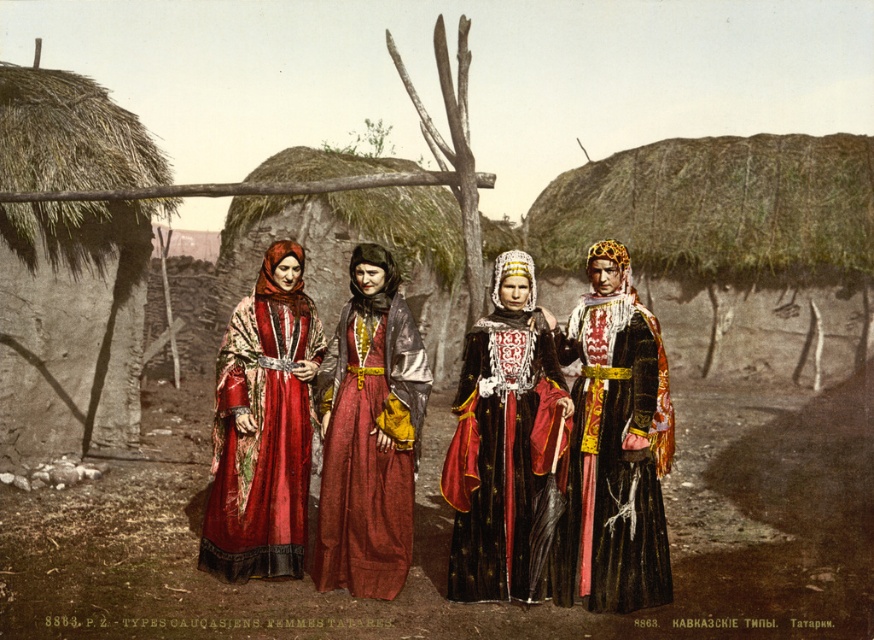
Question: Which object is positioned closest to the black velvet dress at center?

Choices:
 (A) velvet black dress at center
 (B) matte red dress at center

Answer: (A)

Question: Where is velvet black dress at center located in relation to matte red dress at center in the image?

Choices:
 (A) below
 (B) above

Answer: (A)

Question: Estimate the real-world distances between objects in this image. Which object is farther from the black velvet dress at center?

Choices:
 (A) matte red dress at center
 (B) shiny red dress at center
 (C) velvet black dress at center

Answer: (B)

Question: Which object is farther from the camera taking this photo?

Choices:
 (A) black velvet dress at center
 (B) shiny red dress at center
 (C) velvet black dress at center

Answer: (B)

Question: Considering the relative positions of black velvet dress at center and shiny red dress at center in the image provided, where is black velvet dress at center located with respect to shiny red dress at center?

Choices:
 (A) left
 (B) right

Answer: (B)

Question: Is velvet black dress at center closer to camera compared to shiny red dress at center?

Choices:
 (A) yes
 (B) no

Answer: (A)